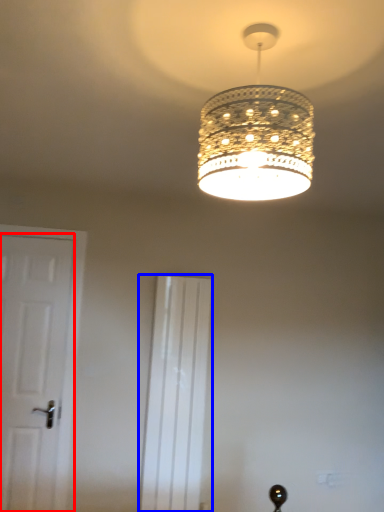
Question: Which point is further to the camera, door (highlighted by a red box) or screen door (highlighted by a blue box)?

Choices:
 (A) door
 (B) screen door

Answer: (B)